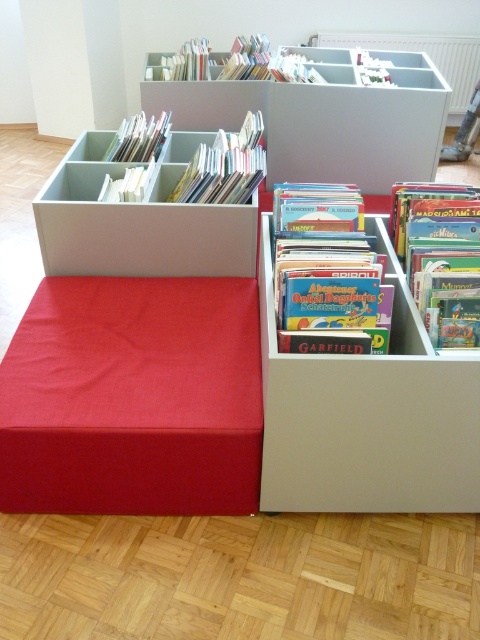
You are organizing a library and need to place a new book on the shelf. The book you have is 12 inches wide. Can the matte cardboard book at center fit on the matte cardboard bookshelf at center without overlapping other items?

The matte cardboard bookshelf at center and matte cardboard book at center are 28.69 inches apart from each other. Since the book is only 12 inches wide, there is enough space for the matte cardboard book at center to fit on the matte cardboard bookshelf at center without overlapping other items.

You are organizing books in a library and see the matte plastic storage at center and the hardcover book at center. Which object is located to the left of the other?

A: The matte plastic storage at center is positioned on the left side of the hardcover book at center.

You are organizing books in a library and see the matte plastic storage at center and the matte cardboard book at center. Which object is positioned to the left?

The matte plastic storage at center is to the left of the matte cardboard book at center.